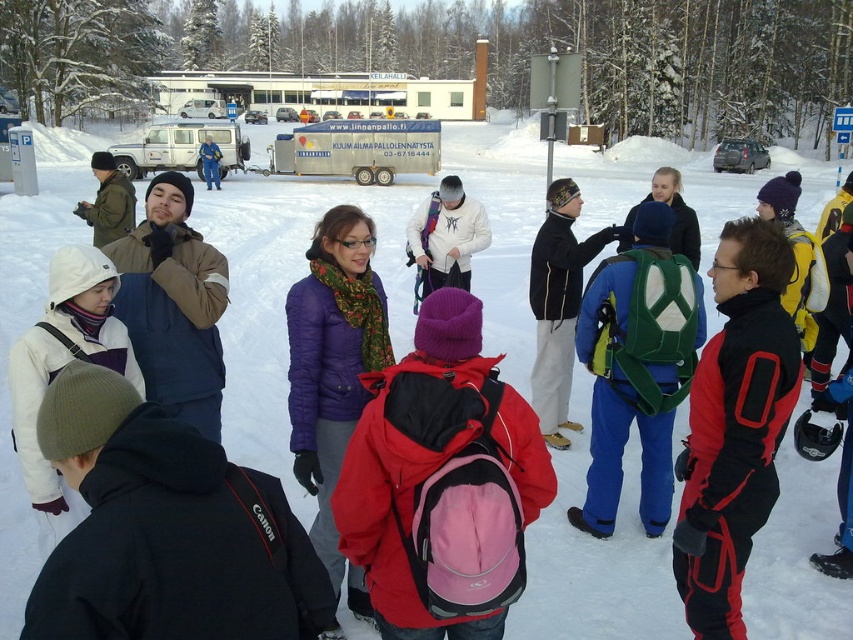
Question: Which of the following is the closest to the observer?

Choices:
 (A) black fleece jacket at lower left
 (B) green fabric backpack at center
 (C) white fleece jacket at lower left
 (D) matte green jacket at center

Answer: (A)

Question: Considering the real-world distances, which object is farthest from the purple quilted jacket at center?

Choices:
 (A) white matte jacket at center
 (B) red synthetic jacket at center right
 (C) black fleece jacket at lower left
 (D) green fabric backpack at center

Answer: (A)

Question: Does pink fabric backpack at center appear on the right side of blue denim jacket at center?

Choices:
 (A) no
 (B) yes

Answer: (B)

Question: Is white matte jacket at center positioned in front of blue denim jacket at center?

Choices:
 (A) yes
 (B) no

Answer: (A)

Question: Does black fleece jacket at lower left have a greater width compared to blue denim jacket at center?

Choices:
 (A) no
 (B) yes

Answer: (A)

Question: Which object is the closest to the brown fuzzy vest at left?

Choices:
 (A) purple quilted jacket at center
 (B) red synthetic jacket at center right

Answer: (A)